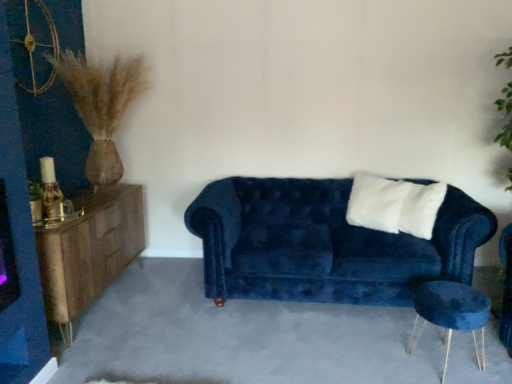
You are a GUI agent. You are given a task and a screenshot of the screen. Output one action in this format:
    pyautogui.click(x=<x>, y=<y>)
    Task: Click on the velvet blue side table at lower right
    
    Given the screenshot: What is the action you would take?
    pyautogui.click(x=451, y=313)

What do you see at coordinates (324, 244) in the screenshot? I see `velvet blue couch at center` at bounding box center [324, 244].

I want to click on velvet blue side table at lower right, so [x=451, y=313].

Which is behind, point (257, 230) or point (75, 314)?

The point (257, 230) is behind.

Which of these two, velvet blue couch at center or woodenmaterial/texturedresser at left, is smaller?

Smaller between the two is woodenmaterial/texturedresser at left.

There is a woodenmaterial/texturedresser at left. Where is `studio couch above it (from a real-world perspective)`? studio couch above it (from a real-world perspective) is located at coordinates (324, 244).

From the image's perspective, does velvet blue couch at center appear higher than woodenmaterial/texturedresser at left?

Correct, velvet blue couch at center appears higher than woodenmaterial/texturedresser at left in the image.

From their relative heights in the image, would you say white soft pillow at center is taller or shorter than velvet blue couch at center?

In the image, white soft pillow at center appears to be shorter than velvet blue couch at center.

Is white soft pillow at center facing towards velvet blue couch at center?

Yes, white soft pillow at center is oriented towards velvet blue couch at center.

The width and height of the screenshot is (512, 384). Find the location of `studio couch beneath the white soft pillow at center (from a real-world perspective)`. studio couch beneath the white soft pillow at center (from a real-world perspective) is located at coordinates [x=324, y=244].

Is white soft pillow at center bigger or smaller than velvet blue couch at center?

Considering their sizes, white soft pillow at center takes up less space than velvet blue couch at center.

The image size is (512, 384). In the image, there is a woodenmaterial/texturedresser at left. Find the location of `side table below it (from a real-world perspective)`. side table below it (from a real-world perspective) is located at coordinates (451, 313).

Is velvet blue side table at lower right facing towards woodenmaterial/texturedresser at left?

Yes, velvet blue side table at lower right faces towards woodenmaterial/texturedresser at left.

Does point (426, 313) come behind point (53, 286)?

No, it is not.

How different are the orientations of velvet blue side table at lower right and woodenmaterial/texturedresser at left in degrees?

The angular difference between velvet blue side table at lower right and woodenmaterial/texturedresser at left is 175 degrees.

From the image's perspective, is woodenmaterial/texturedresser at left located above or below white soft pillow at center?

woodenmaterial/texturedresser at left is situated lower than white soft pillow at center in the image.

Is woodenmaterial/texturedresser at left looking in the opposite direction of white soft pillow at center?

No, white soft pillow at center is not at the back of woodenmaterial/texturedresser at left.

Based on their positions, is woodenmaterial/texturedresser at left located to the left or right of white soft pillow at center?

From the image, it's evident that woodenmaterial/texturedresser at left is to the left of white soft pillow at center.

Between woodenmaterial/texturedresser at left and white soft pillow at center, which one has larger size?

woodenmaterial/texturedresser at left is bigger.

Find the location of a particular element. side table below the white soft pillow at center (from a real-world perspective) is located at coordinates (451, 313).

Does velvet blue side table at lower right have a lesser height compared to white soft pillow at center?

Indeed, velvet blue side table at lower right has a lesser height compared to white soft pillow at center.

Is velvet blue side table at lower right further to the viewer compared to white soft pillow at center?

That is False.

Is white soft pillow at center facing away from velvet blue side table at lower right?

No.

From the image's perspective, is white soft pillow at center on velvet blue side table at lower right?

Yes, from the image's perspective, white soft pillow at center is above velvet blue side table at lower right.

Considering the relative positions of white soft pillow at center and velvet blue side table at lower right in the image provided, is white soft pillow at center to the left or to the right of velvet blue side table at lower right?

white soft pillow at center is positioned on velvet blue side table at lower right's right side.

Considering the points (102, 269) and (482, 327), which point is behind, point (102, 269) or point (482, 327)?

The point (102, 269) is behind.

Which object is thinner, woodenmaterial/texturedresser at left or velvet blue side table at lower right?

velvet blue side table at lower right is thinner.

Is velvet blue side table at lower right located within woodenmaterial/texturedresser at left?

No.

Does woodenmaterial/texturedresser at left appear on the left side of velvet blue side table at lower right?

Yes, woodenmaterial/texturedresser at left is to the left of velvet blue side table at lower right.

At what (x,y) coordinates should I click in order to perform the action: click on dresser beneath the velvet blue couch at center (from a real-world perspective). Please return your answer as a coordinate pair (x, y). Looking at the image, I should click on (89, 251).

The image size is (512, 384). Identify the location of pillow behind the velvet blue couch at center. 421,209.

Considering their positions, is velvet blue couch at center positioned further to white soft pillow at center than velvet blue side table at lower right?

Among the two, velvet blue side table at lower right is located further to white soft pillow at center.

Based on their spatial positions, is white soft pillow at center or velvet blue side table at lower right further from woodenmaterial/texturedresser at left?

white soft pillow at center is positioned further to the anchor woodenmaterial/texturedresser at left.

From the image, which object appears to be farther from white soft pillow at center, woodenmaterial/texturedresser at left or velvet blue couch at center?

Among the two, woodenmaterial/texturedresser at left is located further to white soft pillow at center.

From the image, which object appears to be nearer to white soft pillow at center, velvet blue side table at lower right or woodenmaterial/texturedresser at left?

Among the two, velvet blue side table at lower right is located nearer to white soft pillow at center.

In the scene shown: Based on their spatial positions, is velvet blue side table at lower right or woodenmaterial/texturedresser at left further from velvet blue couch at center?

The object further to velvet blue couch at center is woodenmaterial/texturedresser at left.

Considering their positions, is velvet blue couch at center positioned further to white soft pillow at center than woodenmaterial/texturedresser at left?

The object further to white soft pillow at center is woodenmaterial/texturedresser at left.

Based on their spatial positions, is woodenmaterial/texturedresser at left or velvet blue side table at lower right further from white soft pillow at center?

woodenmaterial/texturedresser at left lies further to white soft pillow at center than the other object.

From the image, which object appears to be farther from velvet blue side table at lower right, woodenmaterial/texturedresser at left or white soft pillow at center?

Among the two, woodenmaterial/texturedresser at left is located further to velvet blue side table at lower right.

Where is `studio couch between woodenmaterial/texturedresser at left and velvet blue side table at lower right from left to right`? This screenshot has height=384, width=512. studio couch between woodenmaterial/texturedresser at left and velvet blue side table at lower right from left to right is located at coordinates (324, 244).

At what (x,y) coordinates should I click in order to perform the action: click on side table located between velvet blue couch at center and white soft pillow at center in the left-right direction. Please return your answer as a coordinate pair (x, y). This screenshot has height=384, width=512. Looking at the image, I should click on (451, 313).

Find the location of a particular element. The image size is (512, 384). side table located between woodenmaterial/texturedresser at left and white soft pillow at center in the left-right direction is located at coordinates (451, 313).

Where is `studio couch located between woodenmaterial/texturedresser at left and white soft pillow at center in the left-right direction`? studio couch located between woodenmaterial/texturedresser at left and white soft pillow at center in the left-right direction is located at coordinates (324, 244).